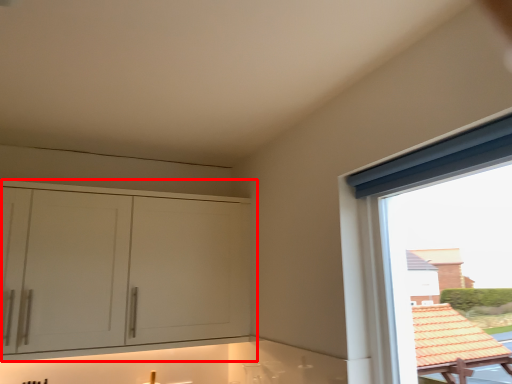
Question: Observing the image, what is the correct spatial positioning of cabinetry (annotated by the red box) in reference to window?

Choices:
 (A) right
 (B) left

Answer: (B)